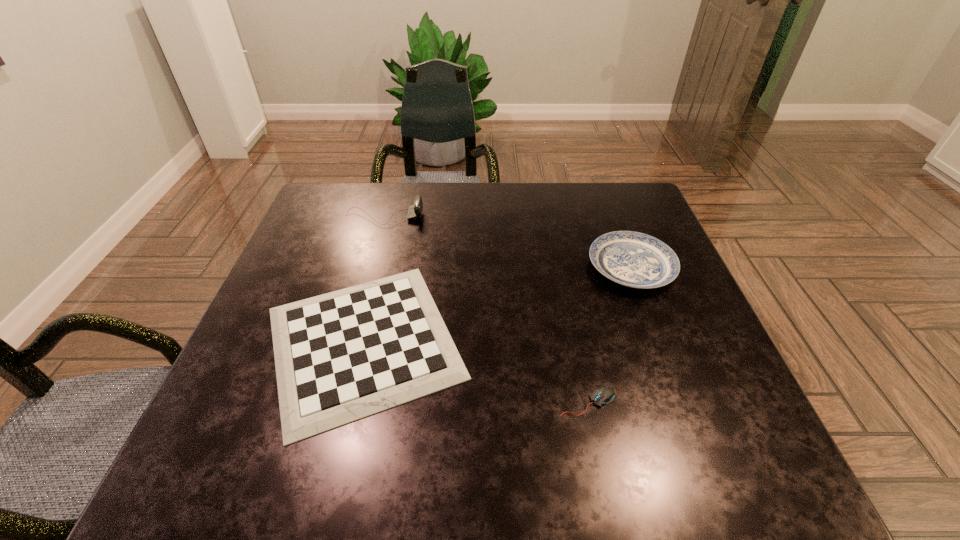
Identify the location of free space between the webcam and the mouse. This screenshot has height=540, width=960. (486, 309).

Where is `free space between the mouse and the farthest object`? free space between the mouse and the farthest object is located at coordinates (486, 309).

I want to click on vacant area between the third object from left to right and the chessboard, so click(475, 372).

I want to click on object that is the closest one to the third object from left to right, so click(342, 356).

Select which object appears as the closest to the chessboard. Please provide its 2D coordinates. Your answer should be formatted as a tuple, i.e. [(x, y)], where the tuple contains the x and y coordinates of a point satisfying the conditions above.

[(604, 395)]

Image resolution: width=960 pixels, height=540 pixels. I want to click on vacant area that satisfies the following two spatial constraints: 1. on the front-facing side of the tallest object; 2. on the right side of the third shortest object, so click(x=371, y=267).

In order to click on vacant area that satisfies the following two spatial constraints: 1. on the back side of the rightmost object; 2. on the front-facing side of the tallest object in this screenshot , I will do `click(612, 217)`.

The height and width of the screenshot is (540, 960). I want to click on blank space that satisfies the following two spatial constraints: 1. on the front-facing side of the plate; 2. on the left side of the farthest object, so click(371, 267).

You are a GUI agent. You are given a task and a screenshot of the screen. Output one action in this format:
    pyautogui.click(x=<x>, y=<y>)
    Task: Click on the free space that satisfies the following two spatial constraints: 1. on the front-facing side of the third object from left to right; 2. on the left side of the webcam
    
    Given the screenshot: What is the action you would take?
    [x=334, y=402]

This screenshot has height=540, width=960. I want to click on vacant space that satisfies the following two spatial constraints: 1. on the front-facing side of the webcam; 2. on the right side of the chessboard, so click(x=350, y=342).